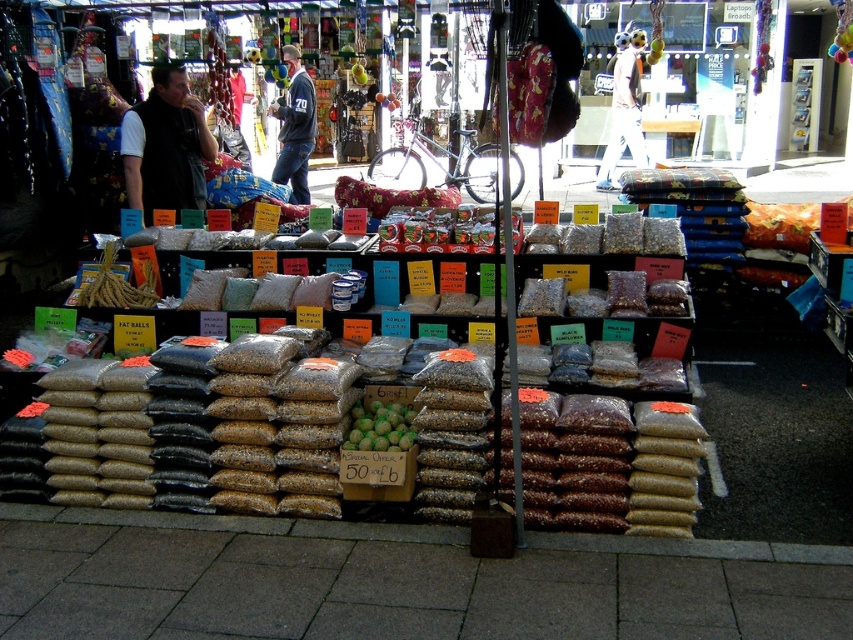
You are a customer at the market stall and want to place an order for both the black vest at left and the white plush teddy bear at upper center. If you have a limited space in your shopping bag, which item should you choose to carry first to save space?

The black vest at left occupies less space than the white plush teddy bear at upper center, so you should carry the black vest at left first to save space.

You are a customer at the market stall and want to buy both the black vest at left and the white plush teddy bear at upper center. If you have a bag that can only hold items up to 10 cm in thickness, which item should you check first to ensure it fits?

The black vest at left is thinner than the white plush teddy bear at upper center, so you should check the white plush teddy bear at upper center first since it is thicker and may exceed the bag limit.